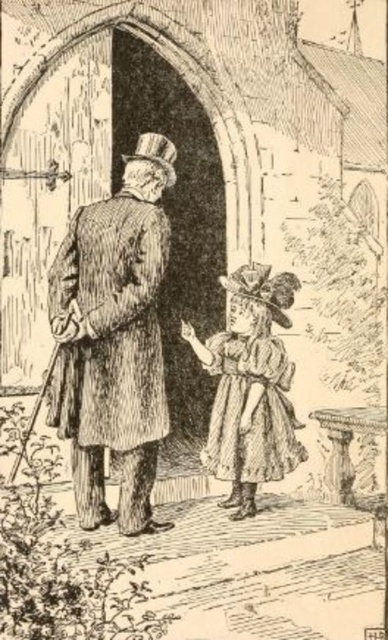
From the picture: You are a fashion designer observing the image. You need to place a decorative pin on the brown textured coat at center. Where exactly should you place it?

The brown textured coat at center is located at point (114, 337), so you should place the decorative pin at those coordinates.